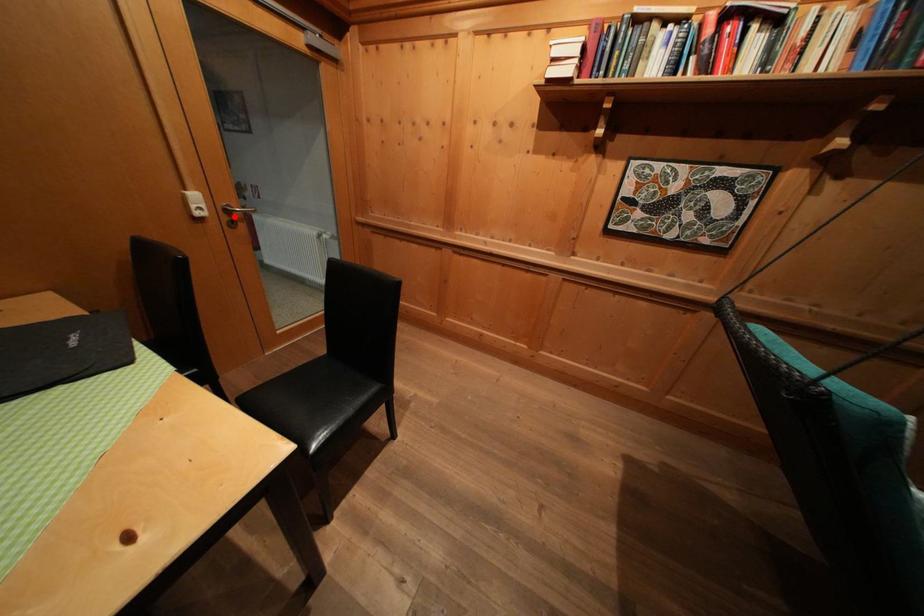
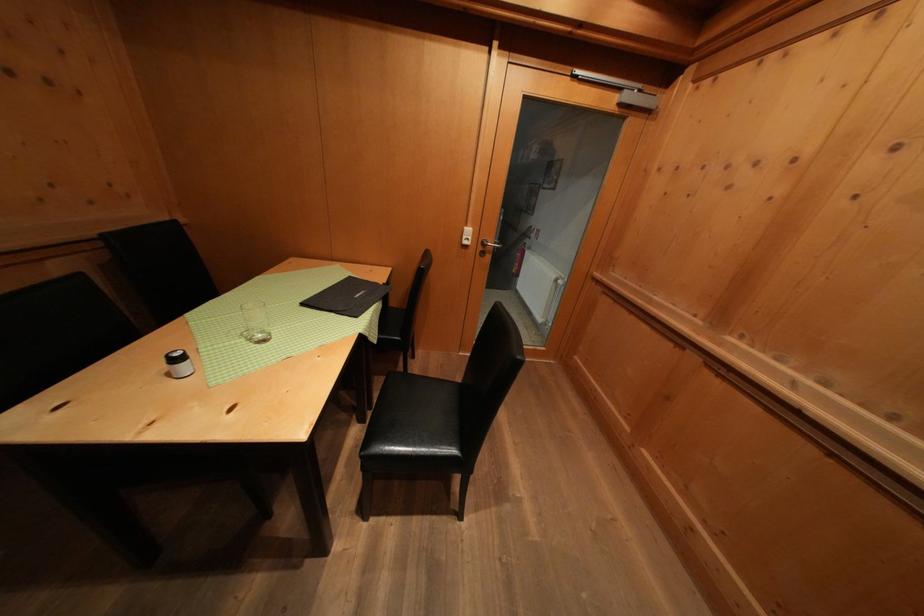
Question: I am providing you with two images of the same scene from different viewpoints. Given a red point in image1, look at the same physical point in image2. Is it:

Choices:
 (A) Closer to the viewpoint
 (B) Farther from the viewpoint

Answer: (B)